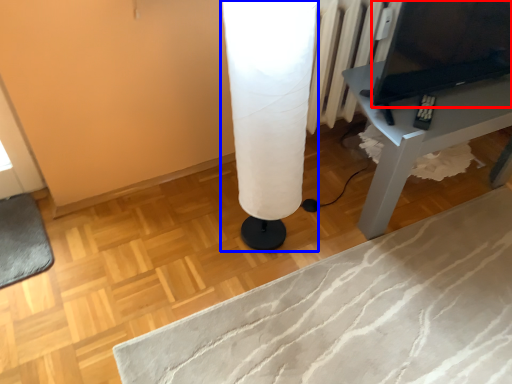
Question: Among these objects, which one is farthest to the camera, computer (highlighted by a red box) or table lamp (highlighted by a blue box)?

Choices:
 (A) computer
 (B) table lamp

Answer: (A)